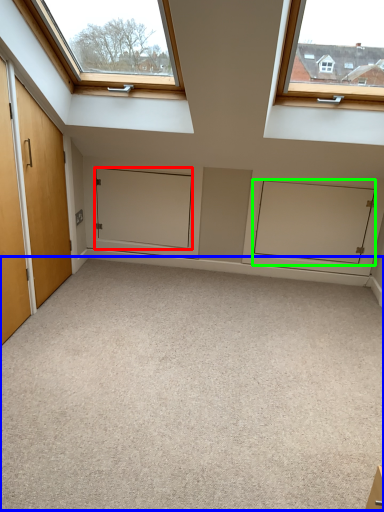
Question: Which object is the closest to the door (highlighted by a red box)? Choose among these: plain (highlighted by a blue box) or cabinetry (highlighted by a green box).

Choices:
 (A) plain
 (B) cabinetry

Answer: (B)